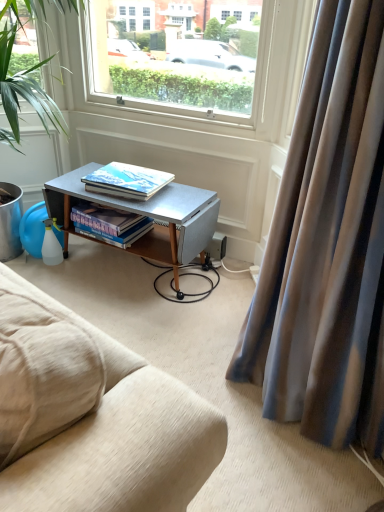
Describe the element at coordinates (127, 181) in the screenshot. The height and width of the screenshot is (512, 384). I see `matte hardcover book at center, the 2th book from the bottom` at that location.

Identify the location of hardcover books at center, the 2th book viewed from the top. This screenshot has height=512, width=384. (109, 224).

Looking at this image, measure the distance between point (19, 152) and camera.

The depth of point (19, 152) is 6.80 feet.

This screenshot has width=384, height=512. What are the coordinates of `metallic gray desk at center` in the screenshot? It's located at (147, 216).

From the image's perspective, is satin fabric curtain at right under hardcover books at center, which is the 1th book in bottom-to-top order?

Yes, from the image's perspective, satin fabric curtain at right is beneath hardcover books at center, which is the 1th book in bottom-to-top order.

From a real-world perspective, between satin fabric curtain at right and hardcover books at center, which is the 1th book in bottom-to-top order, who is vertically lower?

hardcover books at center, which is the 1th book in bottom-to-top order.

Is point (314, 324) in front of point (145, 224)?

That is True.

How far apart are satin fabric curtain at right and hardcover books at center, the 2th book viewed from the top?

satin fabric curtain at right and hardcover books at center, the 2th book viewed from the top, are 3.45 feet apart from each other.

Is hardcover books at center, the 2th book viewed from the top, next to satin fabric curtain at right?

No.

Between hardcover books at center, the 2th book viewed from the top, and satin fabric curtain at right, which one has smaller width?

hardcover books at center, the 2th book viewed from the top, is thinner.

From the image's perspective, is hardcover books at center, which is the 1th book in bottom-to-top order, on top of satin fabric curtain at right?

Yes.

Who is smaller, hardcover books at center, the 2th book viewed from the top, or satin fabric curtain at right?

hardcover books at center, the 2th book viewed from the top, is smaller.

From the image's perspective, relative to green leafy plant at left, is satin fabric curtain at right above or below?

From the image's perspective, satin fabric curtain at right appears below green leafy plant at left.

Is the surface of satin fabric curtain at right in direct contact with green leafy plant at left?

No, satin fabric curtain at right is not beside green leafy plant at left.

Which is more to the right, satin fabric curtain at right or green leafy plant at left?

satin fabric curtain at right.

Is satin fabric curtain at right facing towards green leafy plant at left?

No, satin fabric curtain at right does not turn towards green leafy plant at left.

From the picture: Can you tell me how much metallic gray desk at center and hardcover books at center, the 2th book viewed from the top, differ in facing direction?

The facing directions of metallic gray desk at center and hardcover books at center, the 2th book viewed from the top, are 5.24 degrees apart.

Is hardcover books at center, the 2th book viewed from the top, completely or partially inside metallic gray desk at center?

Yes, hardcover books at center, the 2th book viewed from the top, is inside metallic gray desk at center.

Which is in front, metallic gray desk at center or hardcover books at center, the 2th book viewed from the top?

metallic gray desk at center is more forward.

Is point (207, 196) less distant than point (120, 218)?

Yes, point (207, 196) is closer to viewer.

From the image's perspective, between green leafy plant at left and matte hardcover book at center, placed as the first book when sorted from top to bottom, who is located below?

matte hardcover book at center, placed as the first book when sorted from top to bottom, is shown below in the image.

Looking at this image, between green leafy plant at left and matte hardcover book at center, the 2th book from the bottom, which one has more height?

Standing taller between the two is green leafy plant at left.

From a real-world perspective, count 1st books downward from the green leafy plant at left and point to it. Please provide its 2D coordinates.

[(127, 181)]

Which object is positioned more to the left, green leafy plant at left or matte hardcover book at center, placed as the first book when sorted from top to bottom?

From the viewer's perspective, green leafy plant at left appears more on the left side.

Considering the points (141, 238) and (319, 60), which point is in front, point (141, 238) or point (319, 60)?

Positioned in front is point (319, 60).

Which is correct: metallic gray desk at center is inside satin fabric curtain at right, or outside of it?

metallic gray desk at center lies outside satin fabric curtain at right.

From the picture: Which of these two, metallic gray desk at center or satin fabric curtain at right, is bigger?

Bigger between the two is satin fabric curtain at right.

Considering the relative positions of metallic gray desk at center and green leafy plant at left in the image provided, is metallic gray desk at center to the left of green leafy plant at left from the viewer's perspective?

No, metallic gray desk at center is not to the left of green leafy plant at left.

Is metallic gray desk at center turned away from green leafy plant at left?

No.

From the image's perspective, is metallic gray desk at center above or below green leafy plant at left?

metallic gray desk at center is situated lower than green leafy plant at left in the image.

This screenshot has height=512, width=384. In order to click on the 2nd book behind the satin fabric curtain at right, counting from the anchor's position in this screenshot , I will do `click(109, 224)`.

Locate an element on the screen. This screenshot has width=384, height=512. curtain above the hardcover books at center, the 2th book viewed from the top (from a real-world perspective) is located at coordinates (327, 246).

Estimate the real-world distances between objects in this image. Which object is further from matte hardcover book at center, the 2th book from the bottom, hardcover books at center, which is the 1th book in bottom-to-top order, or satin fabric curtain at right?

Based on the image, satin fabric curtain at right appears to be further to matte hardcover book at center, the 2th book from the bottom.

Which object lies nearer to the anchor point matte hardcover book at center, placed as the first book when sorted from top to bottom, green leafy plant at left or hardcover books at center, the 2th book viewed from the top?

Among the two, hardcover books at center, the 2th book viewed from the top, is located nearer to matte hardcover book at center, placed as the first book when sorted from top to bottom.

In the scene shown: Estimate the real-world distances between objects in this image. Which object is further from satin fabric curtain at right, hardcover books at center, which is the 1th book in bottom-to-top order, or metallic gray desk at center?

hardcover books at center, which is the 1th book in bottom-to-top order.

Based on the photo, when comparing their distances from green leafy plant at left, does hardcover books at center, the 2th book viewed from the top, or satin fabric curtain at right seem closer?

hardcover books at center, the 2th book viewed from the top, lies closer to green leafy plant at left than the other object.

Which object lies further to the anchor point green leafy plant at left, satin fabric curtain at right or metallic gray desk at center?

satin fabric curtain at right is further to green leafy plant at left.

Based on their spatial positions, is green leafy plant at left or matte hardcover book at center, the 2th book from the bottom, further from hardcover books at center, the 2th book viewed from the top?

Based on the image, green leafy plant at left appears to be further to hardcover books at center, the 2th book viewed from the top.

Considering their positions, is metallic gray desk at center positioned closer to matte hardcover book at center, placed as the first book when sorted from top to bottom, than satin fabric curtain at right?

Based on the image, metallic gray desk at center appears to be nearer to matte hardcover book at center, placed as the first book when sorted from top to bottom.

Which object lies nearer to the anchor point matte hardcover book at center, the 2th book from the bottom, green leafy plant at left or satin fabric curtain at right?

Among the two, green leafy plant at left is located nearer to matte hardcover book at center, the 2th book from the bottom.

I want to click on desk located between satin fabric curtain at right and hardcover books at center, the 2th book viewed from the top, in the depth direction, so click(x=147, y=216).

Locate an element on the screen. book located between green leafy plant at left and hardcover books at center, which is the 1th book in bottom-to-top order, in the depth direction is located at coordinates (127, 181).

Image resolution: width=384 pixels, height=512 pixels. Find the location of `desk between satin fabric curtain at right and matte hardcover book at center, placed as the first book when sorted from top to bottom, along the z-axis`. desk between satin fabric curtain at right and matte hardcover book at center, placed as the first book when sorted from top to bottom, along the z-axis is located at coordinates (147, 216).

Locate an element on the screen. desk between green leafy plant at left and hardcover books at center, the 2th book viewed from the top, in the front-back direction is located at coordinates (147, 216).